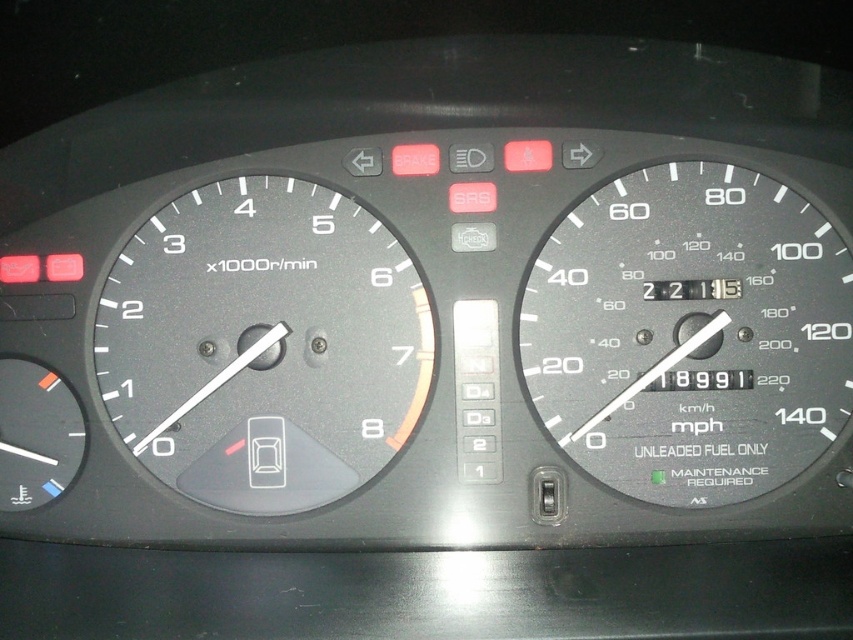
Question: Is black matte speedometer at center right behind matte black tachometer at left?

Choices:
 (A) no
 (B) yes

Answer: (A)

Question: Which point appears closest to the camera in this image?

Choices:
 (A) (648, 250)
 (B) (218, 404)

Answer: (A)

Question: Which point is closer to the camera taking this photo?

Choices:
 (A) (405, 401)
 (B) (753, 323)

Answer: (B)

Question: Is black matte speedometer at center right to the right of matte black tachometer at left from the viewer's perspective?

Choices:
 (A) yes
 (B) no

Answer: (A)

Question: Is black matte speedometer at center right bigger than matte black tachometer at left?

Choices:
 (A) no
 (B) yes

Answer: (B)